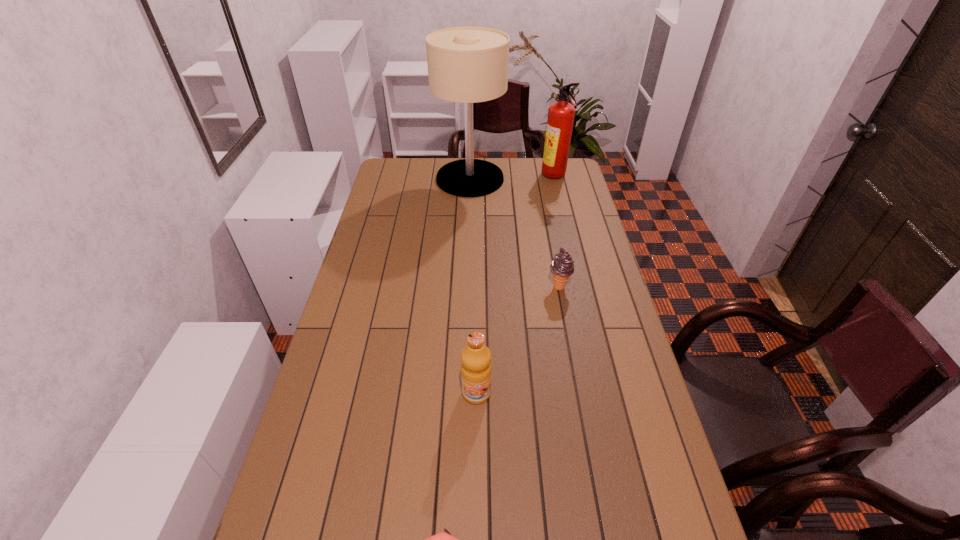
At what (x,y) coordinates should I click in order to perform the action: click on free point between the icecream and the third tallest object. Please return your answer as a coordinate pair (x, y). The width and height of the screenshot is (960, 540). Looking at the image, I should click on (517, 340).

Image resolution: width=960 pixels, height=540 pixels. I want to click on free spot between the tallest object and the icecream, so click(515, 233).

Locate an element on the screen. Image resolution: width=960 pixels, height=540 pixels. free space between the icecream and the fire extinguisher is located at coordinates (557, 231).

This screenshot has height=540, width=960. In order to click on vacant point located between the table lamp and the third tallest object in this screenshot , I will do click(x=473, y=286).

Identify the location of object that can be found as the second closest to the shortest object. (562, 267).

Identify which object is the fourth closest to the fourth farthest object. Please provide its 2D coordinates. Your answer should be formatted as a tuple, i.e. [(x, y)], where the tuple contains the x and y coordinates of a point satisfying the conditions above.

[(561, 114)]

Image resolution: width=960 pixels, height=540 pixels. What are the coordinates of `vacant region that satisfies the following two spatial constraints: 1. on the front-facing side of the fourth shortest object; 2. on the front side of the third farthest object` in the screenshot? It's located at (581, 286).